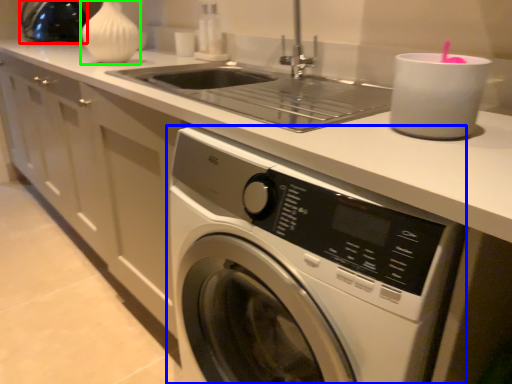
Question: Which is farther away from appliance (highlighted by a red box)? washing machine (highlighted by a blue box) or vase (highlighted by a green box)?

Choices:
 (A) washing machine
 (B) vase

Answer: (A)